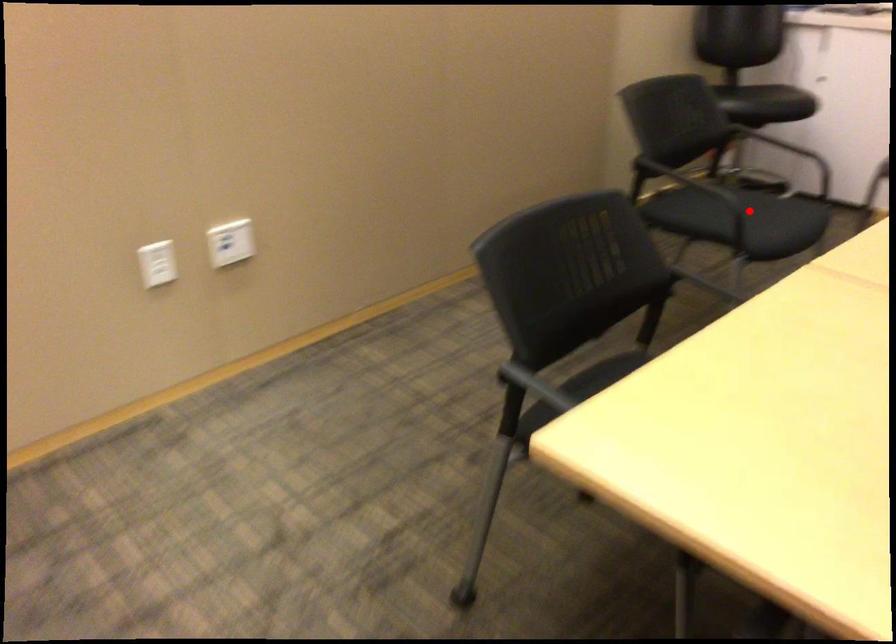
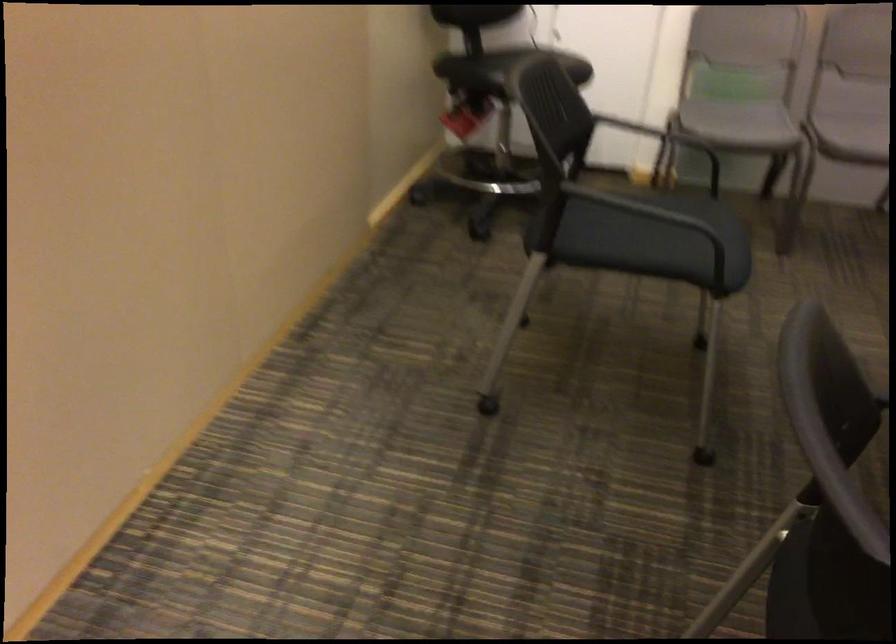
In the second image, find the point that corresponds to the highlighted location in the first image.

(657, 222)